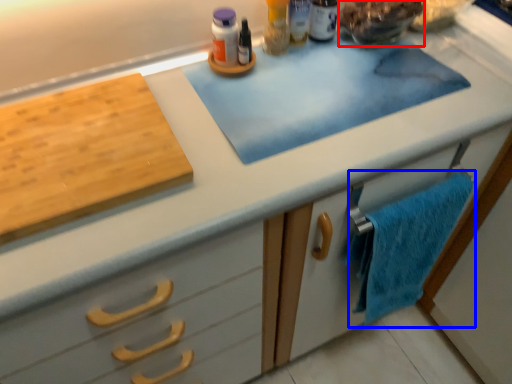
Question: Which point is closer to the camera, food (highlighted by a red box) or bath towel (highlighted by a blue box)?

Choices:
 (A) food
 (B) bath towel

Answer: (B)